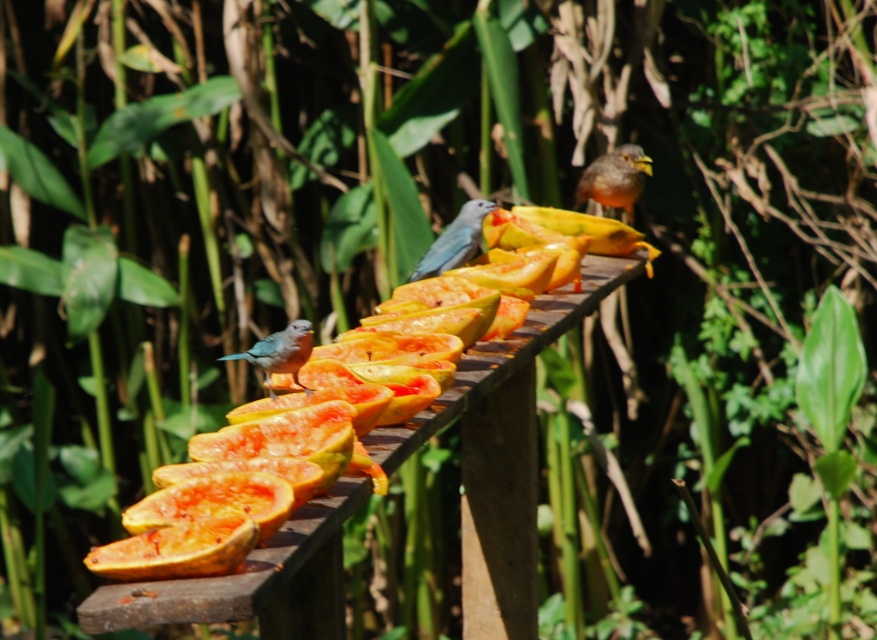
You are standing at a distance of 5 meters from the wooden plank with papaya slices. You want to reach the point marked as point (426, 307) on the plank to place a small item. Can you safely step forward to that point without overstepping the plank?

The distance of point (426, 307) from viewer is 4.70 meters. Since you are currently at 5 meters away, stepping forward would bring you closer to the plank. The point is 4.70 meters away, so stepping forward from 5 meters to 4.70 meters is possible without overstepping the plank.

You are a photographer trying to capture a clear shot of the orange papaya at center and the blue glossy bird at lower left. Which object is closer to the camera, allowing it to be in focus first?

The orange papaya at center is in front of the blue glossy bird at lower left, so it is closer to the camera and would be in focus first.